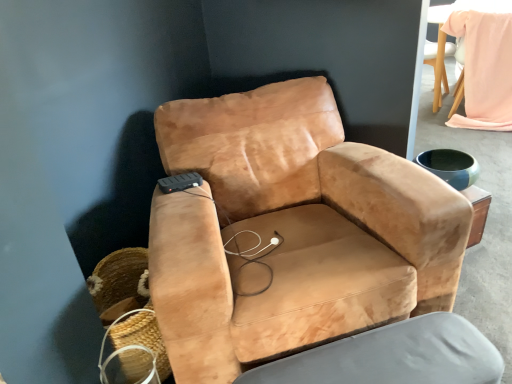
The image size is (512, 384). Find the location of `empty space that is ontop of suede-like tan swivel chair at center`. empty space that is ontop of suede-like tan swivel chair at center is located at coordinates (391, 359).